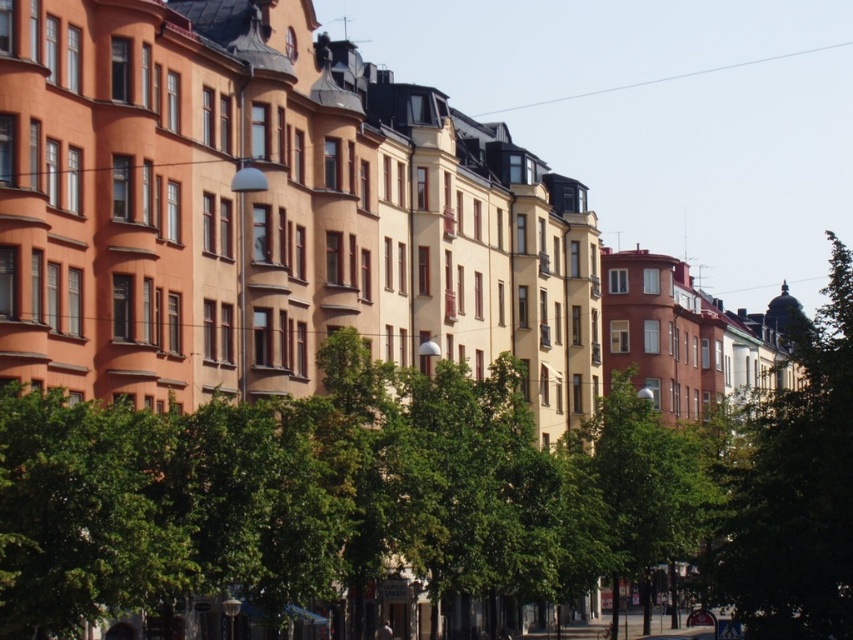
Can you confirm if green leafy tree at center is positioned to the right of transparent wire at upper center?

In fact, green leafy tree at center is to the left of transparent wire at upper center.

Is green leafy tree at center above transparent wire at upper center?

Actually, green leafy tree at center is below transparent wire at upper center.

Is point (13, 461) positioned before point (653, 81)?

That is True.

What are the coordinates of `green leafy tree at center` in the screenshot? It's located at (82, 513).

What do you see at coordinates (82, 513) in the screenshot? I see `green leafy tree at center` at bounding box center [82, 513].

Does point (16, 410) come farther from viewer compared to point (759, 403)?

No.

Does point (85, 502) come in front of point (724, 593)?

Yes, it is in front of point (724, 593).

Where is `green leafy tree at center`? green leafy tree at center is located at coordinates (82, 513).

Can you confirm if green leafy tree at right is taller than transparent wire at upper center?

Yes, green leafy tree at right is taller than transparent wire at upper center.

Does green leafy tree at right come behind transparent wire at upper center?

No, green leafy tree at right is in front of transparent wire at upper center.

Is point (798, 428) positioned after point (718, 68)?

No, (798, 428) is closer to viewer.

Where is `green leafy tree at right`? This screenshot has width=853, height=640. green leafy tree at right is located at coordinates (796, 486).